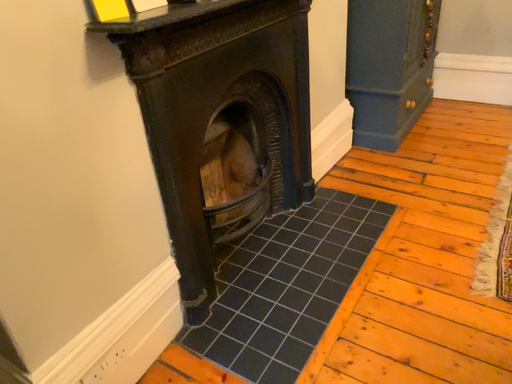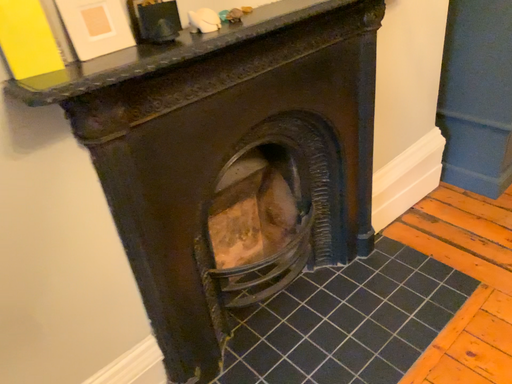
Question: How did the camera likely rotate when shooting the video?

Choices:
 (A) rotated right
 (B) rotated left

Answer: (B)